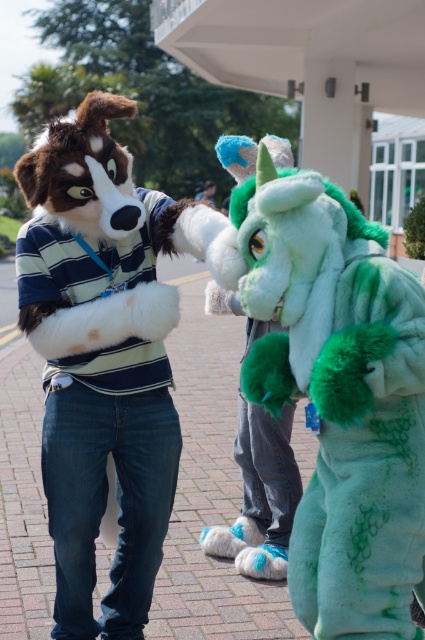
Question: Which object appears closest to the camera in this image?

Choices:
 (A) fuzzy white dog at center
 (B) green fuzzy dragon at center

Answer: (B)

Question: Can you confirm if green fuzzy dragon at center is smaller than fuzzy white dog at center?

Choices:
 (A) no
 (B) yes

Answer: (B)

Question: Does green fuzzy dragon at center have a smaller size compared to fuzzy white dog at center?

Choices:
 (A) yes
 (B) no

Answer: (A)

Question: Can you confirm if green fuzzy dragon at center is bigger than fuzzy white dog at center?

Choices:
 (A) yes
 (B) no

Answer: (B)

Question: Which object appears closest to the camera in this image?

Choices:
 (A) fuzzy white dog at center
 (B) green fuzzy dragon at center

Answer: (B)